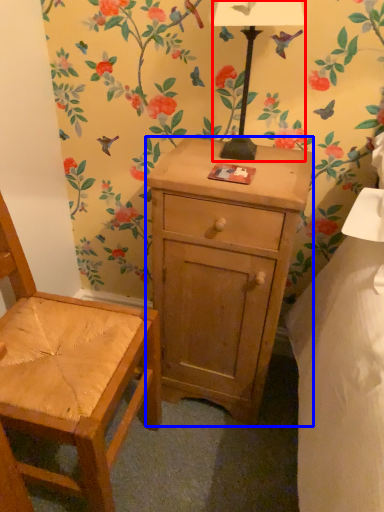
Question: Which object appears closest to the camera in this image, lamp (highlighted by a red box) or desk (highlighted by a blue box)?

Choices:
 (A) lamp
 (B) desk

Answer: (A)